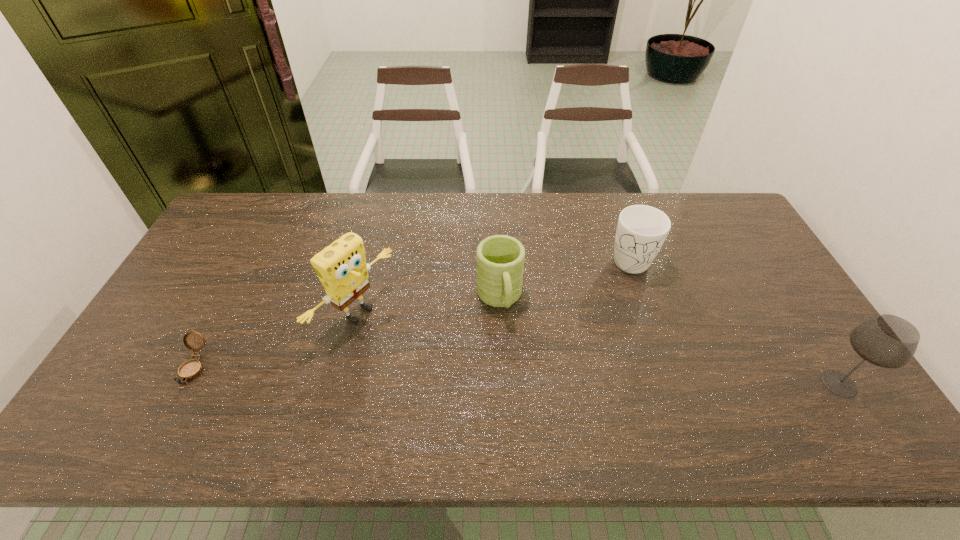
Locate an element on the screen. The height and width of the screenshot is (540, 960). the shortest object is located at coordinates (191, 369).

Identify the location of the leftmost object. (191, 369).

This screenshot has width=960, height=540. I want to click on wineglass, so click(888, 341).

At what (x,y) coordinates should I click in order to perform the action: click on the left mug. Please return your answer as a coordinate pair (x, y). The height and width of the screenshot is (540, 960). Looking at the image, I should click on (500, 259).

Locate an element on the screen. Image resolution: width=960 pixels, height=540 pixels. sponge is located at coordinates (341, 267).

Find the location of a particular element. The image size is (960, 540). the fourth object from left to right is located at coordinates [x=641, y=231].

At what (x,y) coordinates should I click in order to perform the action: click on vacant point located on the back of the rightmost object. Please return your answer as a coordinate pair (x, y). Looking at the image, I should click on (796, 316).

At what (x,y) coordinates should I click in order to perform the action: click on vacant space located on the side of the third object from right to left with the handle. Please return your answer as a coordinate pair (x, y). This screenshot has width=960, height=540. Looking at the image, I should click on [510, 348].

Where is `free location located 0.190m on the side of the third object from right to left with the handle`? The image size is (960, 540). free location located 0.190m on the side of the third object from right to left with the handle is located at coordinates (518, 384).

You are a GUI agent. You are given a task and a screenshot of the screen. Output one action in this format:
    pyautogui.click(x=<x>, y=<y>)
    Task: Click on the vacant space located on the side of the third object from right to left with the handle
    The width and height of the screenshot is (960, 540).
    Given the screenshot: What is the action you would take?
    pyautogui.click(x=508, y=339)